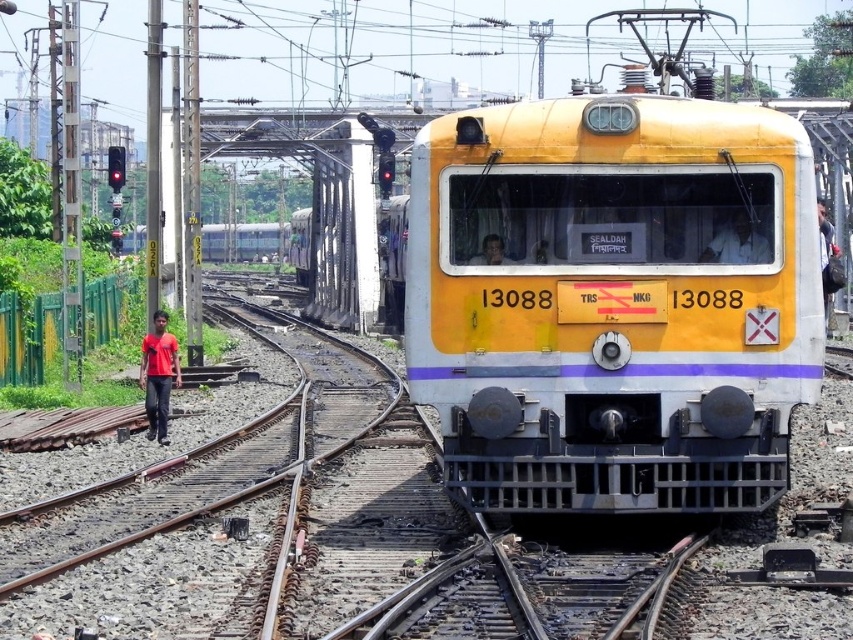
Question: Which object is closer to the camera taking this photo?

Choices:
 (A) red matte shirt at left
 (B) matte black face at center
 (C) white fabric shirt at center

Answer: (C)

Question: Estimate the real-world distances between objects in this image. Which object is farther from the red matte shirt at left?

Choices:
 (A) white fabric shirt at center
 (B) matte black face at center

Answer: (A)

Question: Is red matte shirt at left positioned at the back of white fabric shirt at center?

Choices:
 (A) no
 (B) yes

Answer: (B)

Question: Does red matte shirt at left have a greater width compared to white fabric shirt at center?

Choices:
 (A) yes
 (B) no

Answer: (A)

Question: Which point appears farthest from the camera in this image?

Choices:
 (A) (491, 244)
 (B) (751, 221)
 (C) (154, 422)

Answer: (C)

Question: Is red matte shirt at left to the right of matte black face at center from the viewer's perspective?

Choices:
 (A) yes
 (B) no

Answer: (B)